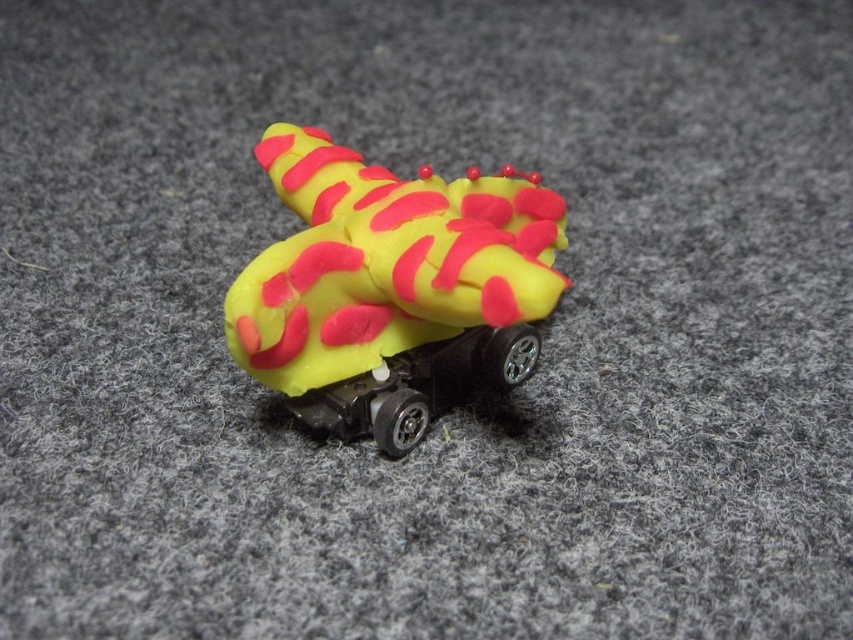
Consider the image. You are a child playing with toys on a gray carpet. You have a yellow matte toy at center and a yellow matte toy car at center. Which toy is closer to you?

The yellow matte toy at center is closer to you because it is in front of the yellow matte toy car at center.

You are a child playing with a toy car and want to place it exactly at the center of your play area. The play area is a square mat with coordinates from 0 to 1 on both axes. You have the yellow matte toy at center in your hand. Where should you place it to be exactly at the center?

The yellow matte toy at center is already positioned at point (390, 285), which is very close to the exact center of the play area. Since the center of the square mat is at (426, 320), you can move it slightly towards the top right to align perfectly.

You are a child trying to place a small sticker on the yellow matte toy at center and the yellow matte toy car at center. The sticker is 4 inches long. Can you fit the sticker between them without overlapping either toy?

The distance between the yellow matte toy at center and the yellow matte toy car at center is 3.85 inches. Since the sticker is 4 inches long, it cannot fit between them without overlapping one of the toys.